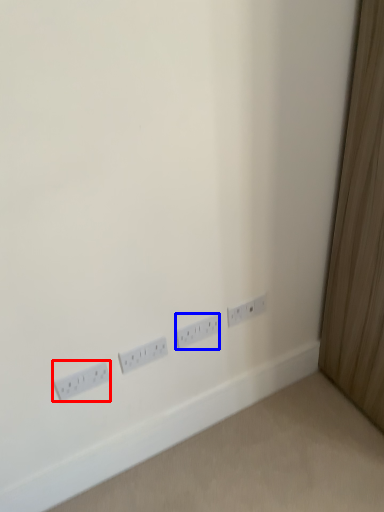
Question: Which object appears closest to the camera in this image, power plugs and sockets (highlighted by a red box) or power plugs and sockets (highlighted by a blue box)?

Choices:
 (A) power plugs and sockets
 (B) power plugs and sockets

Answer: (A)